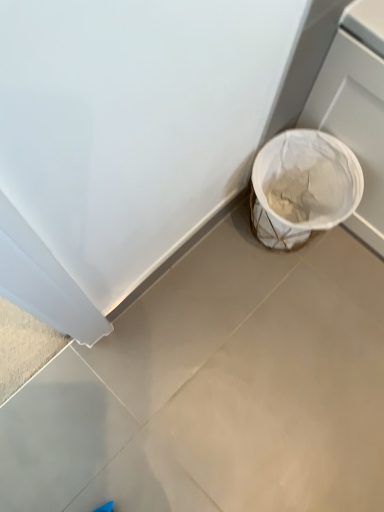
Question: From the image's perspective, is white matte trash can at lower right on top of white woven basket at lower right?

Choices:
 (A) no
 (B) yes

Answer: (A)

Question: From a real-world perspective, is white matte trash can at lower right positioned under white woven basket at lower right based on gravity?

Choices:
 (A) no
 (B) yes

Answer: (B)

Question: Considering the relative sizes of white matte trash can at lower right and white woven basket at lower right in the image provided, is white matte trash can at lower right bigger than white woven basket at lower right?

Choices:
 (A) no
 (B) yes

Answer: (A)

Question: Could you tell me if white matte trash can at lower right is turned towards white woven basket at lower right?

Choices:
 (A) yes
 (B) no

Answer: (B)

Question: Can you confirm if white matte trash can at lower right is taller than white woven basket at lower right?

Choices:
 (A) yes
 (B) no

Answer: (B)

Question: From a real-world perspective, is white matte trash can at lower right over white woven basket at lower right?

Choices:
 (A) no
 (B) yes

Answer: (A)

Question: Is white woven basket at lower right looking in the opposite direction of white matte trash can at lower right?

Choices:
 (A) yes
 (B) no

Answer: (B)

Question: Is white woven basket at lower right facing towards white matte trash can at lower right?

Choices:
 (A) no
 (B) yes

Answer: (A)

Question: Is white woven basket at lower right thinner than white matte trash can at lower right?

Choices:
 (A) no
 (B) yes

Answer: (B)

Question: Does white woven basket at lower right have a greater width compared to white matte trash can at lower right?

Choices:
 (A) yes
 (B) no

Answer: (B)

Question: Is the depth of white woven basket at lower right less than that of white matte trash can at lower right?

Choices:
 (A) yes
 (B) no

Answer: (B)

Question: Is white woven basket at lower right to the left of white matte trash can at lower right from the viewer's perspective?

Choices:
 (A) yes
 (B) no

Answer: (B)

Question: Is white woven basket at lower right bigger or smaller than white matte trash can at lower right?

Choices:
 (A) small
 (B) big

Answer: (B)